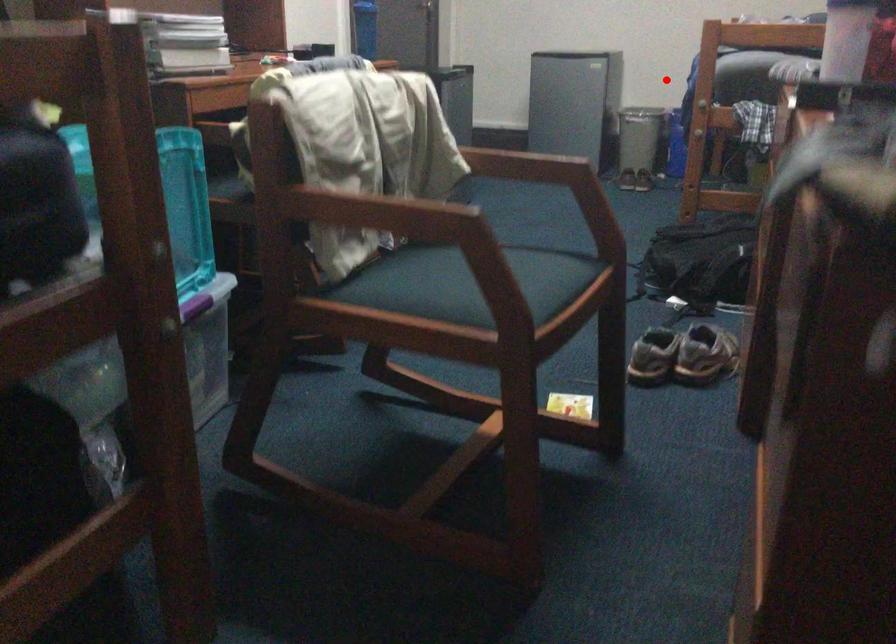
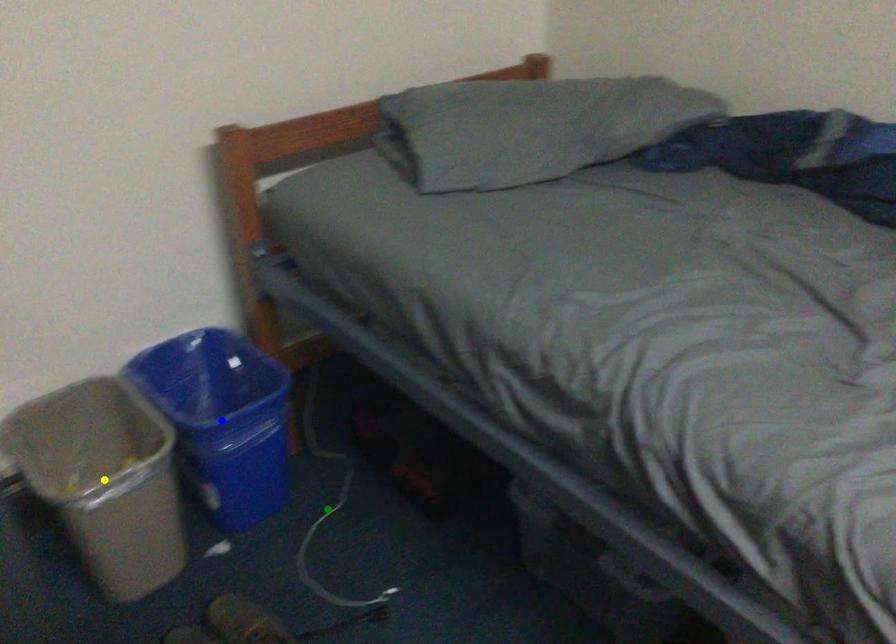
Question: I am providing you with two images of the same scene from different viewpoints. A red point is marked on the first image. You are given multiple points on the second image. Which point in image 2 represents the same 3d spot as the red point in image 1?

Choices:
 (A) green point
 (B) blue point
 (C) yellow point

Answer: (B)